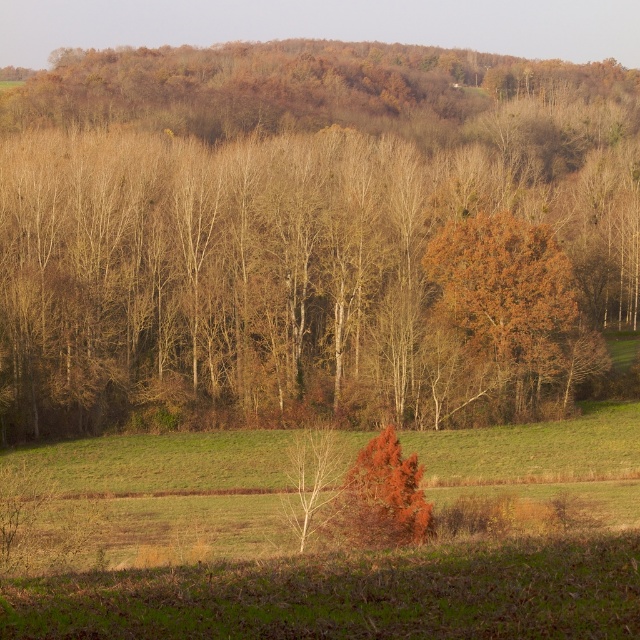
Between brown leafless tree at center and orange-brown wood at center-right, which one appears on the left side from the viewer's perspective?

brown leafless tree at center is more to the left.

Is brown leafless tree at center positioned in front of orange-brown wood at center-right?

Yes.

Find the location of a particular element. brown leafless tree at center is located at coordinates (310, 236).

What are the coordinates of `brown leafless tree at center` in the screenshot? It's located at (310, 236).

Does brown leafless tree at center appear on the right side of orange-brown bark tree at lower center?

Incorrect, brown leafless tree at center is not on the right side of orange-brown bark tree at lower center.

Which is behind, point (291, 193) or point (400, 461)?

Positioned behind is point (291, 193).

At what (x,y) coordinates should I click in order to perform the action: click on brown leafless tree at center. Please return your answer as a coordinate pair (x, y). This screenshot has height=640, width=640. Looking at the image, I should click on (310, 236).

Consider the image. Which is more to the left, orange-brown wood at center-right or orange-brown bark tree at lower center?

From the viewer's perspective, orange-brown bark tree at lower center appears more on the left side.

Is the position of orange-brown wood at center-right more distant than that of orange-brown bark tree at lower center?

That is True.

You are a GUI agent. You are given a task and a screenshot of the screen. Output one action in this format:
    pyautogui.click(x=<x>, y=<y>)
    Task: Click on the orange-brown wood at center-right
    
    Given the screenshot: What is the action you would take?
    pyautogui.click(x=508, y=305)